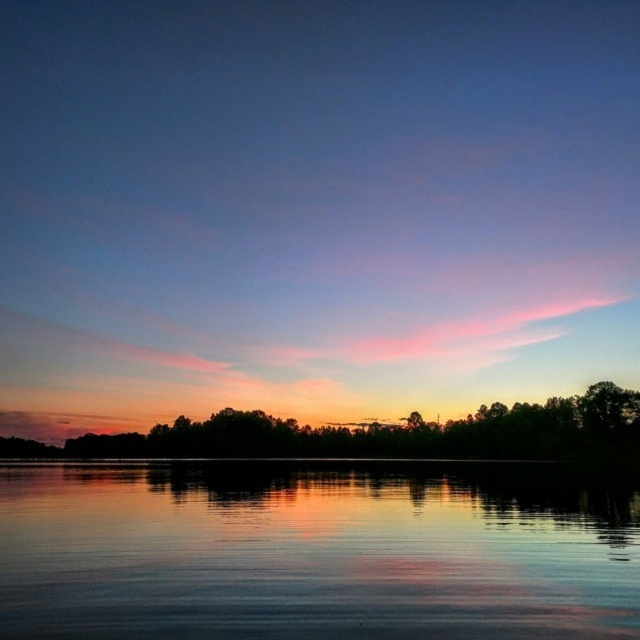
You are an artist planning to paint the sunset scene. You need to decide whether to emphasize the smooth reflective water at center or the green matte trees at center based on their size. Which object should you focus on more because it is wider?

The green matte trees at center are wider than the smooth reflective water at center, so you should focus more on the green matte trees at center in your painting.

You are standing at the edge of the water in the sunset scene. If you want to find the smooth reflective water at center, where should you look relative to your position?

The smooth reflective water at center is located at the coordinates point (x=314, y=552), so you should look towards the center area of the scene to find it.

You are standing on a dock and see the smooth reflective water at center and the green matte trees at center in the distance. Which object is closer to you?

The smooth reflective water at center is closer to you because it is in front of the green matte trees at center.